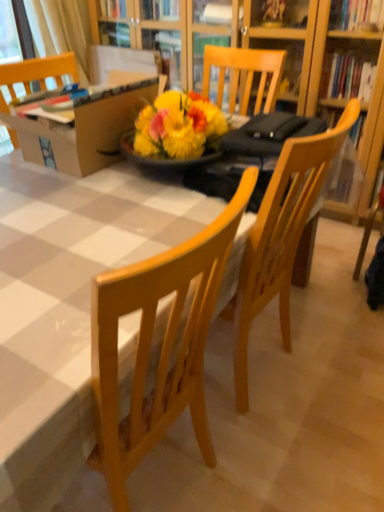
Question: Is cardboard box at upper left bigger than white fabric curtain at upper left?

Choices:
 (A) no
 (B) yes

Answer: (B)

Question: From the image's perspective, would you say cardboard box at upper left is shown under white fabric curtain at upper left?

Choices:
 (A) yes
 (B) no

Answer: (A)

Question: Is cardboard box at upper left positioned with its back to white fabric curtain at upper left?

Choices:
 (A) no
 (B) yes

Answer: (A)

Question: Does cardboard box at upper left appear on the right side of white fabric curtain at upper left?

Choices:
 (A) yes
 (B) no

Answer: (A)

Question: Is cardboard box at upper left in front of white fabric curtain at upper left?

Choices:
 (A) no
 (B) yes

Answer: (B)

Question: From a real-world perspective, relative to cardboard box at upper left, is white fabric curtain at upper left vertically above or below?

Choices:
 (A) above
 (B) below

Answer: (B)

Question: From the image's perspective, is white fabric curtain at upper left positioned above or below cardboard box at upper left?

Choices:
 (A) below
 (B) above

Answer: (B)

Question: Is white fabric curtain at upper left in front of or behind cardboard box at upper left in the image?

Choices:
 (A) behind
 (B) front

Answer: (A)

Question: Is white fabric curtain at upper left taller or shorter than cardboard box at upper left?

Choices:
 (A) short
 (B) tall

Answer: (B)

Question: Choose the correct answer: Is white fabric curtain at upper left inside wooden table at center or outside it?

Choices:
 (A) inside
 (B) outside

Answer: (B)

Question: From the image's perspective, is white fabric curtain at upper left located above or below wooden table at center?

Choices:
 (A) above
 (B) below

Answer: (A)

Question: Considering their positions, is white fabric curtain at upper left located in front of or behind wooden table at center?

Choices:
 (A) behind
 (B) front

Answer: (A)

Question: Is white fabric curtain at upper left wider or thinner than wooden table at center?

Choices:
 (A) thin
 (B) wide

Answer: (A)

Question: In terms of size, does cardboard box at upper left appear bigger or smaller than wooden table at center?

Choices:
 (A) small
 (B) big

Answer: (A)

Question: Considering the positions of point (145, 84) and point (84, 300), is point (145, 84) closer or farther from the camera than point (84, 300)?

Choices:
 (A) closer
 (B) farther

Answer: (B)